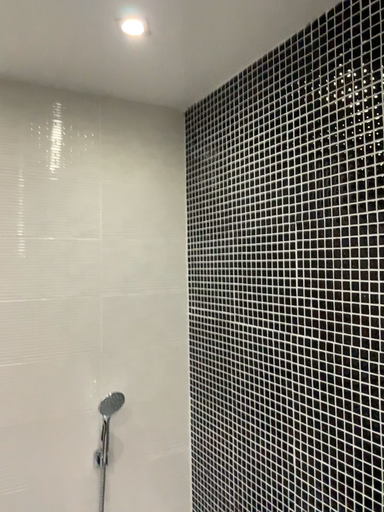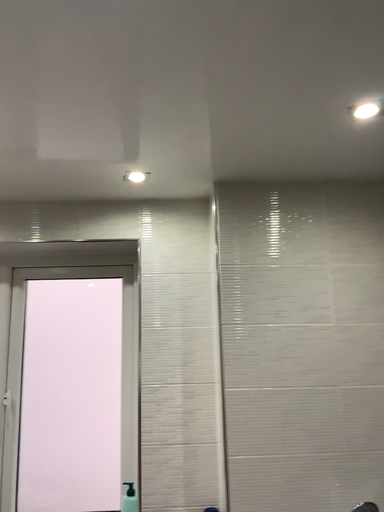
Question: Which way did the camera rotate in the video?

Choices:
 (A) rotated left
 (B) rotated right

Answer: (A)